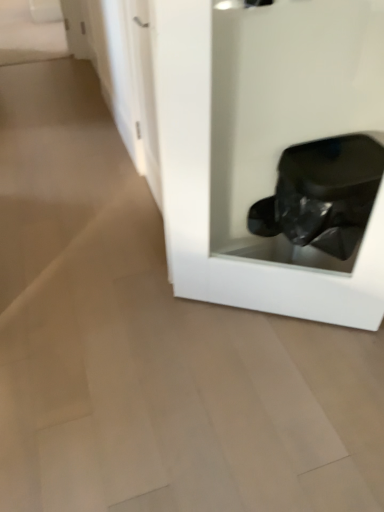
I want to click on white glossy door at upper left, so click(145, 92).

What do you see at coordinates (145, 92) in the screenshot? I see `white glossy door at upper left` at bounding box center [145, 92].

Find the location of a particular element. This screenshot has height=512, width=384. transparent glossy trash can at lower right is located at coordinates (272, 152).

Describe the element at coordinates (272, 152) in the screenshot. This screenshot has width=384, height=512. I see `transparent glossy trash can at lower right` at that location.

You are a GUI agent. You are given a task and a screenshot of the screen. Output one action in this format:
    pyautogui.click(x=<x>, y=<y>)
    Task: Click on the white glossy door at upper left
    The image size is (384, 512).
    Given the screenshot: What is the action you would take?
    pyautogui.click(x=145, y=92)

Considering the positions of objects white glossy door at upper left and transparent glossy trash can at lower right in the image provided, who is more to the right, white glossy door at upper left or transparent glossy trash can at lower right?

transparent glossy trash can at lower right.

Which object is closer to the camera, white glossy door at upper left or transparent glossy trash can at lower right?

transparent glossy trash can at lower right.

Which is less distant, [136,126] or [214,47]?

Point [214,47]

From the image's perspective, which is below, white glossy door at upper left or transparent glossy trash can at lower right?

transparent glossy trash can at lower right.

Looking at this image, from a real-world perspective, does white glossy door at upper left stand above transparent glossy trash can at lower right?

No.

Based on the photo, in terms of width, does white glossy door at upper left look wider or thinner when compared to transparent glossy trash can at lower right?

white glossy door at upper left is thinner than transparent glossy trash can at lower right.

Can you confirm if white glossy door at upper left is shorter than transparent glossy trash can at lower right?

Yes, white glossy door at upper left is shorter than transparent glossy trash can at lower right.

Who is smaller, white glossy door at upper left or transparent glossy trash can at lower right?

white glossy door at upper left.

Can transparent glossy trash can at lower right be found inside white glossy door at upper left?

That's incorrect, transparent glossy trash can at lower right is not inside white glossy door at upper left.

Is white glossy door at upper left far away from transparent glossy trash can at lower right?

Actually, white glossy door at upper left and transparent glossy trash can at lower right are a little close together.

Is white glossy door at upper left oriented towards transparent glossy trash can at lower right?

No, white glossy door at upper left is not facing towards transparent glossy trash can at lower right.

How many degrees apart are the facing directions of white glossy door at upper left and transparent glossy trash can at lower right?

white glossy door at upper left and transparent glossy trash can at lower right are facing 58.9 degrees away from each other.

How much distance is there between white glossy door at upper left and transparent glossy trash can at lower right?

They are 19.70 inches apart.

The width and height of the screenshot is (384, 512). Find the location of `door on the left of transparent glossy trash can at lower right`. door on the left of transparent glossy trash can at lower right is located at coordinates (145, 92).

Based on their positions, is transparent glossy trash can at lower right located to the left or right of white glossy door at upper left?

Clearly, transparent glossy trash can at lower right is on the right of white glossy door at upper left in the image.

Which object is further away from the camera, transparent glossy trash can at lower right or white glossy door at upper left?

white glossy door at upper left is further from the camera.

Considering the positions of point (370, 232) and point (132, 64), is point (370, 232) closer or farther from the camera than point (132, 64)?

Point (370, 232) is positioned closer to the camera compared to point (132, 64).

Looking at this image, from the image's perspective, is transparent glossy trash can at lower right under white glossy door at upper left?

Correct, transparent glossy trash can at lower right appears lower than white glossy door at upper left in the image.

From a real-world perspective, is transparent glossy trash can at lower right positioned over white glossy door at upper left based on gravity?

Yes, from a real-world perspective, transparent glossy trash can at lower right is over white glossy door at upper left

Can you confirm if transparent glossy trash can at lower right is thinner than white glossy door at upper left?

No, transparent glossy trash can at lower right is not thinner than white glossy door at upper left.

Is transparent glossy trash can at lower right taller or shorter than white glossy door at upper left?

Clearly, transparent glossy trash can at lower right is taller compared to white glossy door at upper left.

Is transparent glossy trash can at lower right bigger than white glossy door at upper left?

Correct, transparent glossy trash can at lower right is larger in size than white glossy door at upper left.

In the scene shown: Do you think transparent glossy trash can at lower right is within white glossy door at upper left, or outside of it?

transparent glossy trash can at lower right cannot be found inside white glossy door at upper left.

Is transparent glossy trash can at lower right far away from white glossy door at upper left?

transparent glossy trash can at lower right is near white glossy door at upper left, not far away.

Is transparent glossy trash can at lower right looking in the opposite direction of white glossy door at upper left?

No, white glossy door at upper left is not at the back of transparent glossy trash can at lower right.

This screenshot has width=384, height=512. Find the location of `glass door in front of the white glossy door at upper left`. glass door in front of the white glossy door at upper left is located at coordinates coord(272,152).

You are a GUI agent. You are given a task and a screenshot of the screen. Output one action in this format:
    pyautogui.click(x=<x>, y=<y>)
    Task: Click on the door above the transparent glossy trash can at lower right (from the image's perspective)
    
    Given the screenshot: What is the action you would take?
    tap(145, 92)

Identify the location of glass door that is above the white glossy door at upper left (from a real-world perspective). (272, 152).